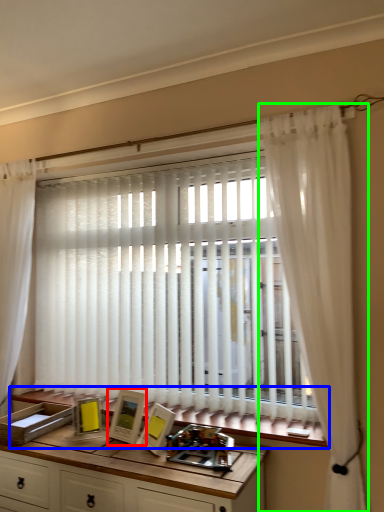
Question: Which is farther away from picture frame (highlighted by a red box)? window sill (highlighted by a blue box) or curtain (highlighted by a green box)?

Choices:
 (A) window sill
 (B) curtain

Answer: (B)